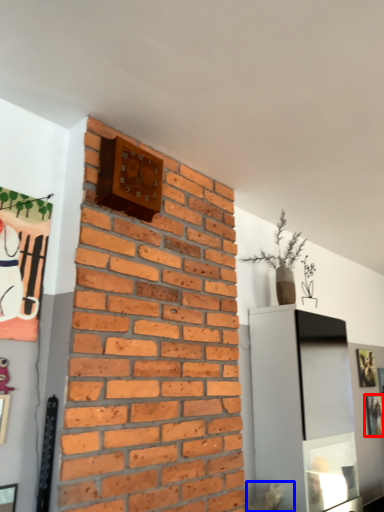
Question: Which object appears closest to the camera in this image, picture frame (highlighted by a red box) or plant (highlighted by a blue box)?

Choices:
 (A) picture frame
 (B) plant

Answer: (B)